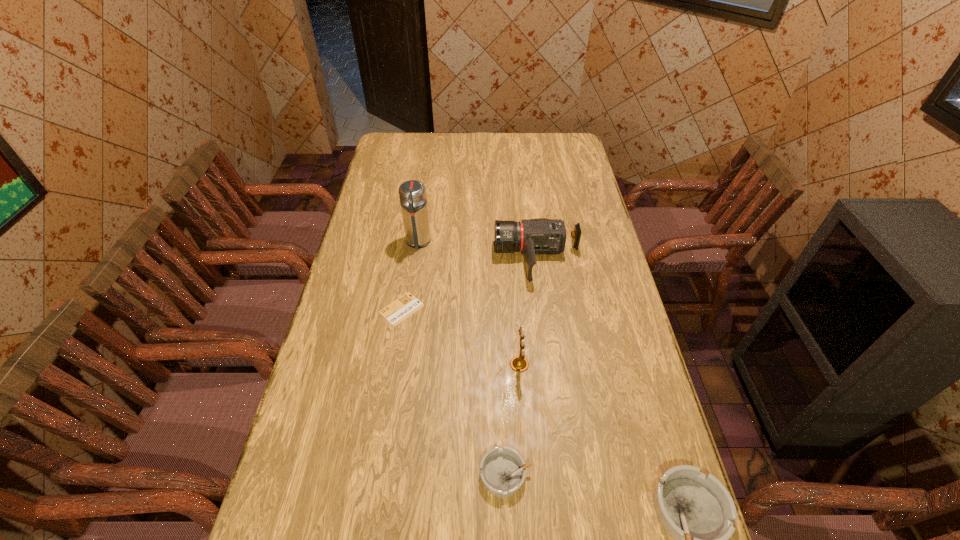
In the image, there is a desktop. At what (x,y) coordinates should I click in order to perform the action: click on vacant space at the right edge. Please return your answer as a coordinate pair (x, y). This screenshot has width=960, height=540. Looking at the image, I should click on (622, 461).

Locate an element on the screen. vacant space at the far left corner of the desktop is located at coordinates (410, 133).

Image resolution: width=960 pixels, height=540 pixels. What are the coordinates of `free spot between the third farthest object and the tallest object` in the screenshot? It's located at (410, 275).

Locate an element on the screen. This screenshot has width=960, height=540. vacant space that's between the candelabrum and the fifth tallest object is located at coordinates (513, 419).

Identify the location of empty space that is in between the fifth tallest object and the candelabrum. The width and height of the screenshot is (960, 540). (513, 419).

Image resolution: width=960 pixels, height=540 pixels. I want to click on free space between the candelabrum and the camcorder, so click(x=528, y=311).

I want to click on vacant area that lies between the candelabrum and the tallest object, so click(x=468, y=303).

Locate an element on the screen. vacant point located between the shorter ashtray and the thermos bottle is located at coordinates (462, 358).

At what (x,y) coordinates should I click in order to perform the action: click on free space between the thermos bottle and the candelabrum. Please return your answer as a coordinate pair (x, y). Image resolution: width=960 pixels, height=540 pixels. Looking at the image, I should click on (468, 303).

Locate an element on the screen. The height and width of the screenshot is (540, 960). vacant space in between the shorter ashtray and the candelabrum is located at coordinates [513, 419].